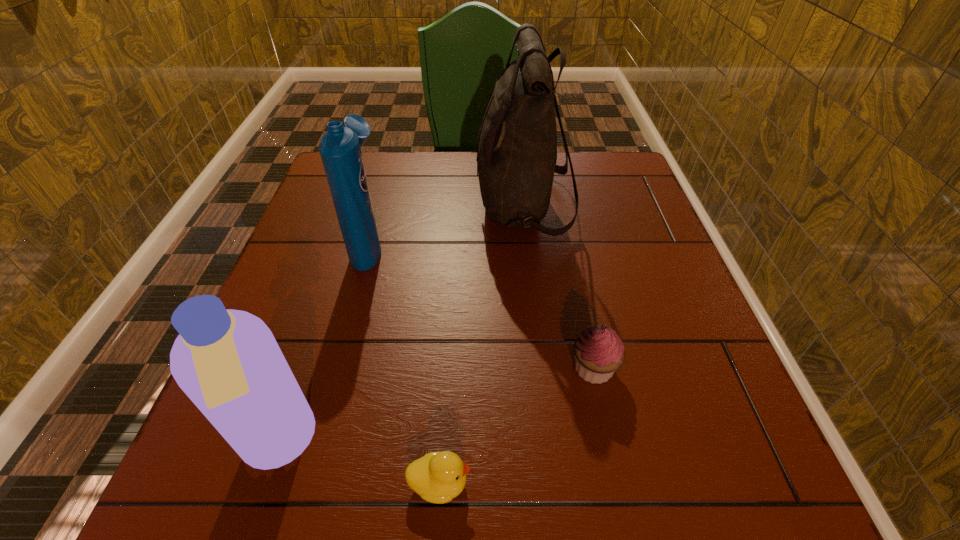
The image size is (960, 540). What are the coordinates of `the tallest object` in the screenshot? It's located at (516, 159).

You are a GUI agent. You are given a task and a screenshot of the screen. Output one action in this format:
    pyautogui.click(x=<x>, y=<y>)
    Task: Click on the farther shampoo
    The width and height of the screenshot is (960, 540).
    Given the screenshot: What is the action you would take?
    pyautogui.click(x=340, y=147)

Find the location of a particular element. The width and height of the screenshot is (960, 540). the nearer shampoo is located at coordinates (228, 363).

This screenshot has width=960, height=540. I want to click on cupcake, so click(599, 352).

I want to click on the second shortest object, so click(599, 352).

This screenshot has width=960, height=540. I want to click on duckling, so click(438, 477).

This screenshot has width=960, height=540. Identify the location of the shortest object. (438, 477).

Identify the location of free space located 0.070m on the open flap of the tallest object. The height and width of the screenshot is (540, 960). (449, 206).

Locate an element on the screen. The height and width of the screenshot is (540, 960). vacant space located on the open flap of the tallest object is located at coordinates (442, 206).

Locate an element on the screen. The image size is (960, 540). blank area located on the open flap of the tallest object is located at coordinates point(369,206).